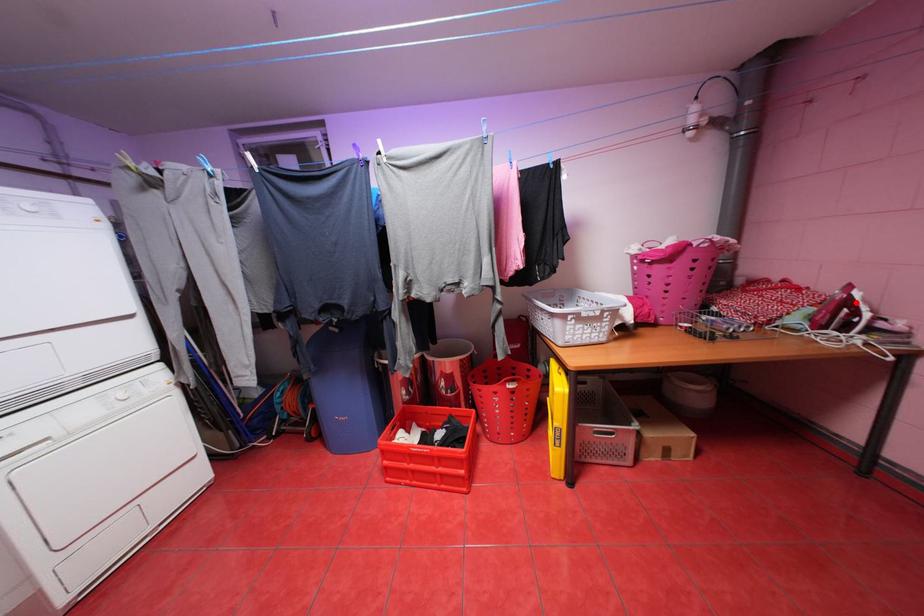
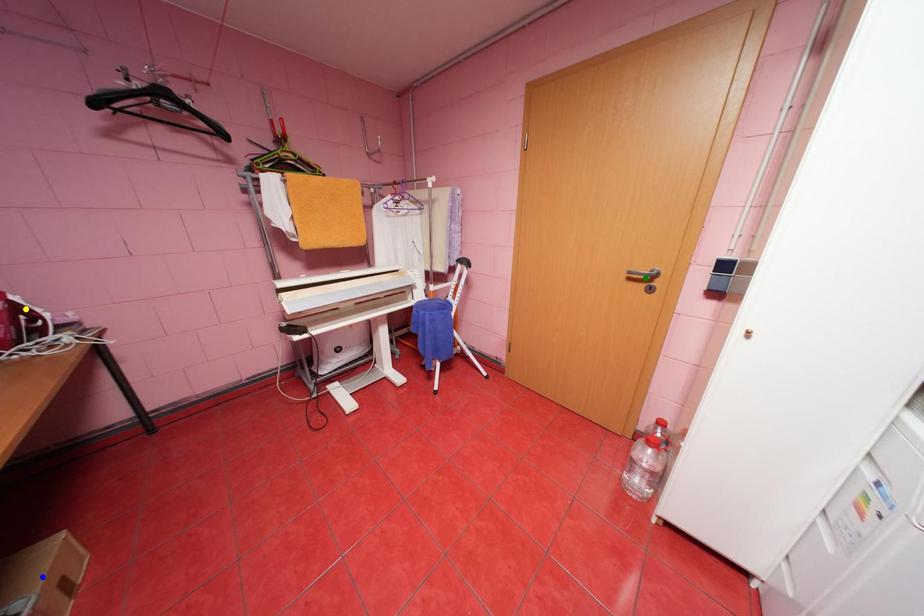
Question: I am providing you with two images of the same scene from different viewpoints. A red point is marked on the first image. You are given multiple points on the second image. In image 2, which mark is for the same physical point as the one in image 1?

Choices:
 (A) green point
 (B) blue point
 (C) yellow point

Answer: (C)